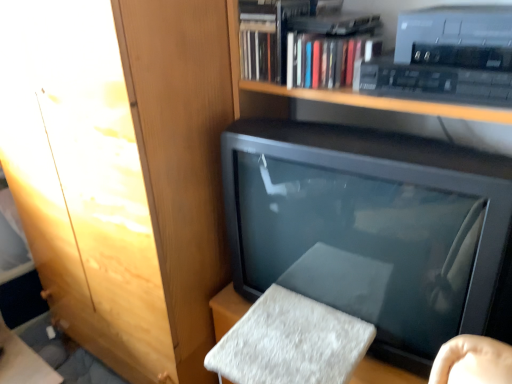
What do you see at coordinates (122, 171) in the screenshot? Image resolution: width=512 pixels, height=384 pixels. I see `wooden cabinet at upper left` at bounding box center [122, 171].

Measure the distance between point (325, 277) and camera.

1.03 meters.

The image size is (512, 384). What do you see at coordinates (326, 59) in the screenshot?
I see `hardcover book at upper center` at bounding box center [326, 59].

Where is `wooden cabinet at upper left`? The width and height of the screenshot is (512, 384). wooden cabinet at upper left is located at coordinates (122, 171).

Is wooden cabinet at upper left facing away from hardcover book at upper center?

No, wooden cabinet at upper left is not facing the opposite direction of hardcover book at upper center.

Which of these two, wooden cabinet at upper left or hardcover book at upper center, stands shorter?

Standing shorter between the two is hardcover book at upper center.

From the image's perspective, which is above, wooden cabinet at upper left or hardcover book at upper center?

hardcover book at upper center.

From the image's perspective, is hardcover book at upper center on wooden cabinet at upper left?

Yes, from the image's perspective, hardcover book at upper center is over wooden cabinet at upper left.

From a real-world perspective, who is located lower, hardcover book at upper center or wooden cabinet at upper left?

In real-world perspective, wooden cabinet at upper left is lower.

Can you confirm if hardcover book at upper center is positioned to the left of wooden cabinet at upper left?

Incorrect, hardcover book at upper center is not on the left side of wooden cabinet at upper left.

Is matte black television at center to the left of hardcover book at upper center from the viewer's perspective?

No, matte black television at center is not to the left of hardcover book at upper center.

Based on their sizes in the image, would you say matte black television at center is bigger or smaller than hardcover book at upper center?

matte black television at center is bigger than hardcover book at upper center.

Is the position of matte black television at center less distant than that of hardcover book at upper center?

Yes, the depth of matte black television at center is less than that of hardcover book at upper center.

Where is `television lying in front of the hardcover book at upper center`? The width and height of the screenshot is (512, 384). television lying in front of the hardcover book at upper center is located at coordinates (371, 228).

Is hardcover book at upper center further to camera compared to matte black television at center?

Yes, it is behind matte black television at center.

Visually, is hardcover book at upper center positioned to the left or to the right of matte black television at center?

hardcover book at upper center is to the left of matte black television at center.

Which object is wider, hardcover book at upper center or matte black television at center?

With larger width is matte black television at center.

Does matte black television at center have a greater width compared to wooden cabinet at upper left?

No.

Based on their sizes in the image, would you say matte black television at center is bigger or smaller than wooden cabinet at upper left?

matte black television at center is smaller than wooden cabinet at upper left.

Could you tell me if matte black television at center is facing wooden cabinet at upper left?

No, matte black television at center is not aimed at wooden cabinet at upper left.

From a real-world perspective, relative to wooden cabinet at upper left, is matte black television at center vertically above or below?

matte black television at center is situated higher than wooden cabinet at upper left in the real world.

Which is closer to the camera, (174, 16) or (436, 177)?

Point (174, 16) is farther from the camera than point (436, 177).

Are wooden cabinet at upper left and matte black television at center far apart?

wooden cabinet at upper left is actually quite close to matte black television at center.

At what (x,y) coordinates should I click in order to perform the action: click on television lying below the wooden cabinet at upper left (from the image's perspective). Please return your answer as a coordinate pair (x, y). The width and height of the screenshot is (512, 384). Looking at the image, I should click on (371, 228).

Between wooden cabinet at upper left and matte black television at center, which one has larger size?

With larger size is wooden cabinet at upper left.

Identify the location of book above the wooden cabinet at upper left (from a real-world perspective). The image size is (512, 384). tap(326, 59).

I want to click on book to the right of wooden cabinet at upper left, so click(x=326, y=59).

Looking at this image, estimate the real-world distances between objects in this image. Which object is closer to wooden cabinet at upper left, hardcover book at upper center or matte black television at center?

matte black television at center.

Estimate the real-world distances between objects in this image. Which object is further from matte black television at center, wooden cabinet at upper left or hardcover book at upper center?

The object further to matte black television at center is wooden cabinet at upper left.

Which object lies further to the anchor point matte black television at center, hardcover book at upper center or wooden cabinet at upper left?

wooden cabinet at upper left is positioned further to the anchor matte black television at center.

Looking at the image, which one is located further to wooden cabinet at upper left, matte black television at center or hardcover book at upper center?

hardcover book at upper center is further to wooden cabinet at upper left.

From the image, which object appears to be farther from hardcover book at upper center, wooden cabinet at upper left or matte black television at center?

wooden cabinet at upper left.

Estimate the real-world distances between objects in this image. Which object is closer to hardcover book at upper center, matte black television at center or wooden cabinet at upper left?

matte black television at center is positioned closer to the anchor hardcover book at upper center.

Identify the location of book between wooden cabinet at upper left and matte black television at center from left to right. (326, 59).